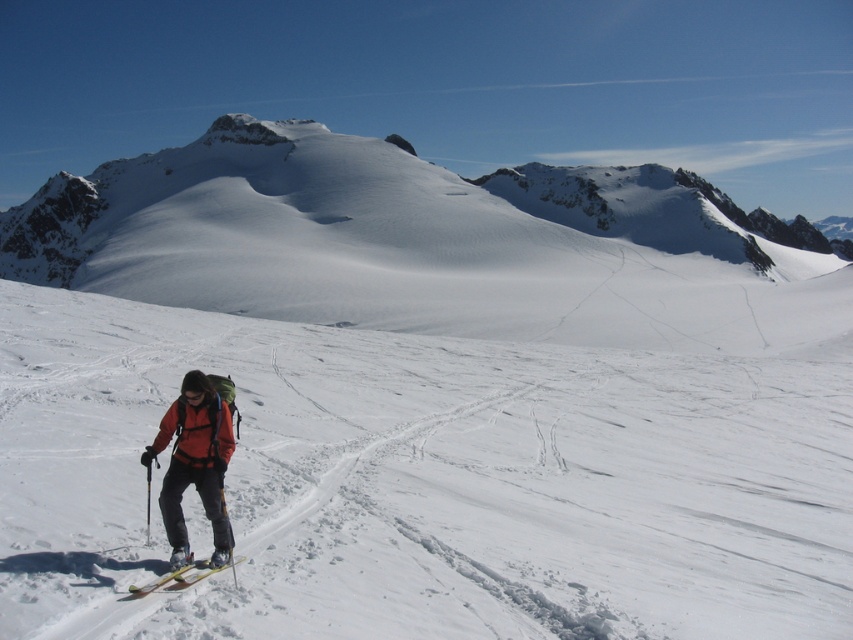
You are a photographer trying to capture the orange softshell jacket at lower left and the yellow matte ski at lower left in the same frame. Based on their positions, which object would appear closer to the camera?

The orange softshell jacket at lower left appears closer to the camera because the yellow matte ski at lower left is positioned behind it.

You are a cross country skier planning your route. You see the white powder snow at center. Where exactly is the white powder snow located in the image?

The white powder snow at center is located at point [422,483].